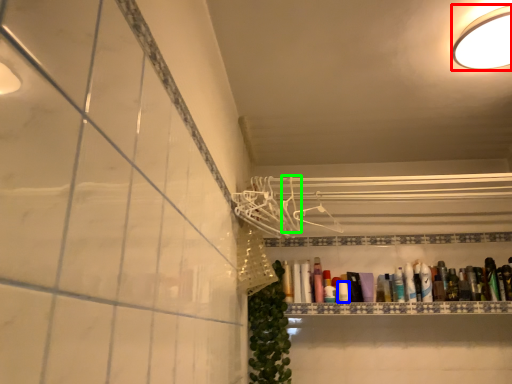
Question: Estimate the real-world distances between objects in this image. Which object is farther from light fixture (highlighted by a red box), toiletry (highlighted by a blue box) or hanger (highlighted by a green box)?

Choices:
 (A) toiletry
 (B) hanger

Answer: (A)